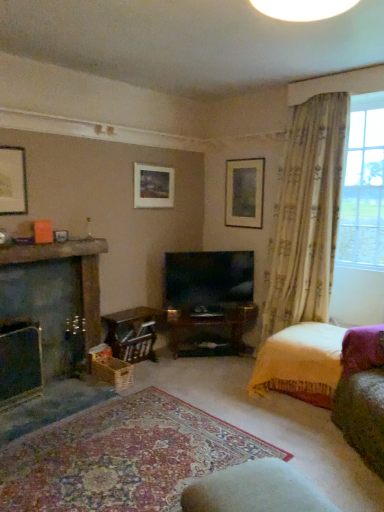
Locate an element on the screen. free space above white fabric rocking chair at lower center (from a real-world perspective) is located at coordinates (264, 487).